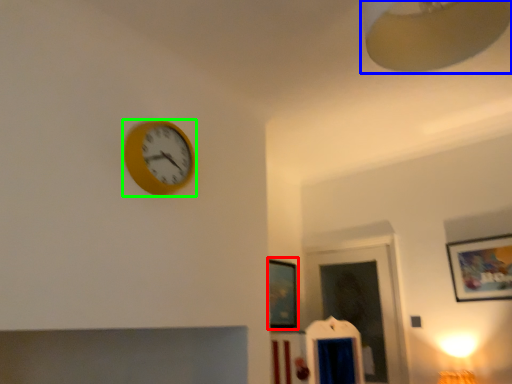
Question: Considering the real-world distances, which object is closest to picture frame (highlighted by a red box)? lamp (highlighted by a blue box) or wall clock (highlighted by a green box).

Choices:
 (A) lamp
 (B) wall clock

Answer: (B)